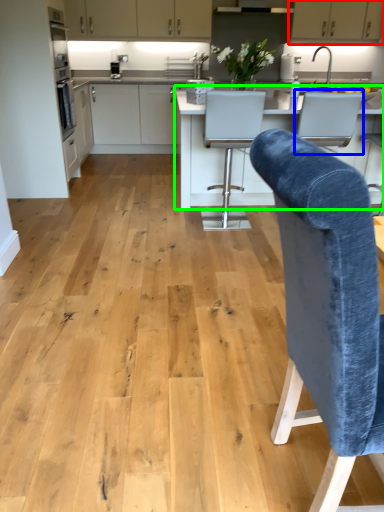
Question: Which object is the closest to the cabinetry (highlighted by a red box)? Choose among these: armchair (highlighted by a blue box) or countertop (highlighted by a green box).

Choices:
 (A) armchair
 (B) countertop

Answer: (B)